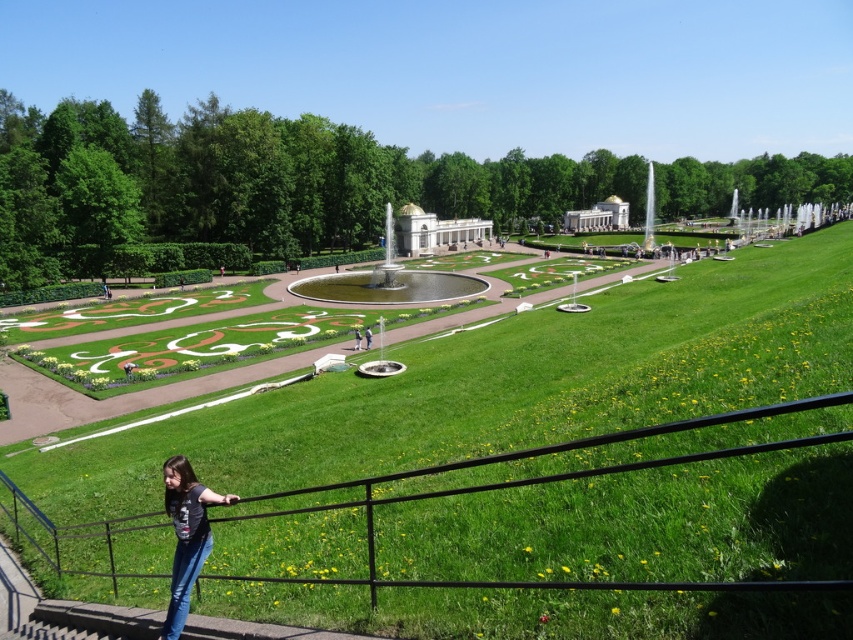
Question: Which object is the closest to the green grass at center?

Choices:
 (A) denim jeans at lower left
 (B) white marble palace at center
 (C) gold metallic fountain at center
 (D) gold dome building at center

Answer: (A)

Question: Which object is the closest to the green grass at center?

Choices:
 (A) denim jeans at lower left
 (B) gold metallic fountain at center
 (C) gold dome building at center
 (D) white marble palace at center

Answer: (A)

Question: Can you confirm if green grass at center is positioned above gold dome building at center?

Choices:
 (A) yes
 (B) no

Answer: (B)

Question: Is gold metallic fountain at center further to camera compared to white marble palace at center?

Choices:
 (A) no
 (B) yes

Answer: (A)

Question: Does green grass at center have a lesser width compared to white marble palace at center?

Choices:
 (A) no
 (B) yes

Answer: (A)

Question: Which object appears closest to the camera in this image?

Choices:
 (A) denim jeans at lower left
 (B) green grass at center
 (C) gold metallic fountain at center

Answer: (B)